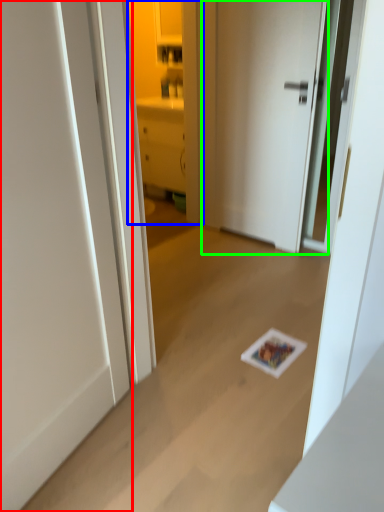
Question: Which object is positioned closest to door (highlighted by a red box)? Select from cabinetry (highlighted by a blue box) and door (highlighted by a green box).

Choices:
 (A) cabinetry
 (B) door

Answer: (B)